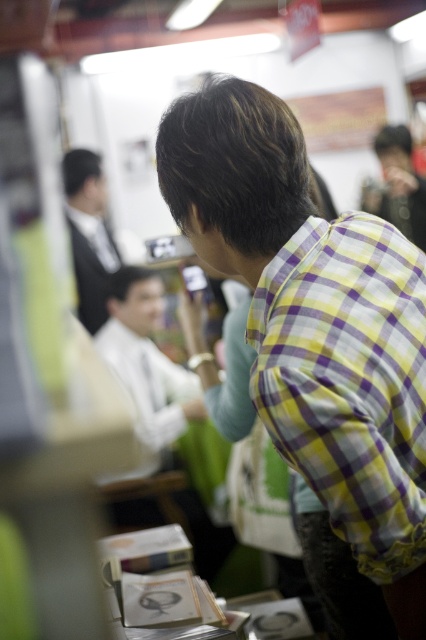
Where is `white shirt at center`? This screenshot has width=426, height=640. white shirt at center is located at coordinates (146, 364).

In the scene shown: Who is more distant from viewer, (108, 317) or (100, 179)?

The point (100, 179) is more distant.

Measure the distance between point [123,365] and camera.

Point [123,365] is 9.53 feet from camera.

This screenshot has width=426, height=640. I want to click on white shirt at center, so click(x=146, y=364).

Measure the distance from white shirt at center to matte black camera at upper right.

white shirt at center is 6.08 feet from matte black camera at upper right.

Is point (123, 276) behind point (391, 148)?

That is False.

Locate an element on the screen. The height and width of the screenshot is (640, 426). white shirt at center is located at coordinates (146, 364).

Can you confirm if formal black suit at upper left is wider than matte black camera at upper right?

No, formal black suit at upper left is not wider than matte black camera at upper right.

Who is taller, formal black suit at upper left or matte black camera at upper right?

With more height is formal black suit at upper left.

Is point (100, 259) in front of point (419, 196)?

Yes, point (100, 259) is in front of point (419, 196).

Identify the location of formal black suit at upper left. The image size is (426, 640). (89, 234).